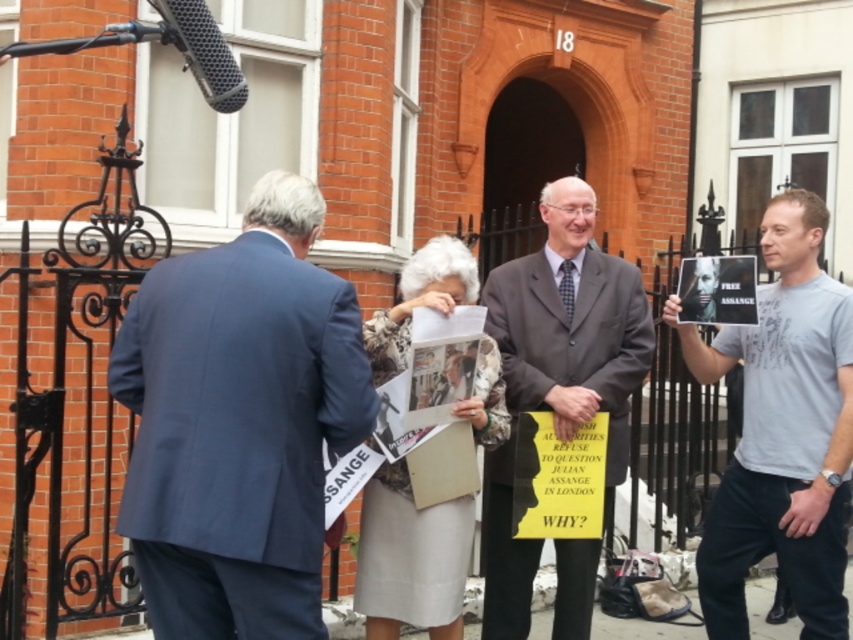
Question: Is gray cotton t-shirt at right above dark gray suit at center?

Choices:
 (A) yes
 (B) no

Answer: (B)

Question: Is dark blue suit at left closer to camera compared to gray cotton t-shirt at right?

Choices:
 (A) yes
 (B) no

Answer: (A)

Question: Which point is farther to the camera?

Choices:
 (A) dark blue suit at left
 (B) black metallic microphone at upper left

Answer: (B)

Question: Which point is closer to the camera?

Choices:
 (A) (225, 45)
 (B) (757, 442)
 (C) (606, 288)

Answer: (A)

Question: Does gray cotton t-shirt at right appear over dark gray suit at center?

Choices:
 (A) yes
 (B) no

Answer: (B)

Question: Which point is closer to the camera?

Choices:
 (A) dark gray suit at center
 (B) gray cotton t-shirt at right

Answer: (B)